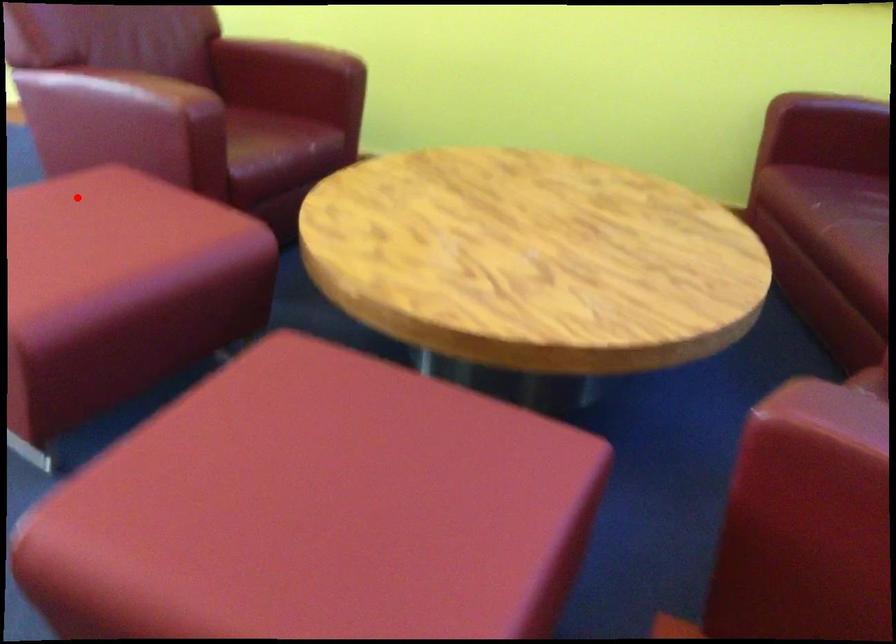
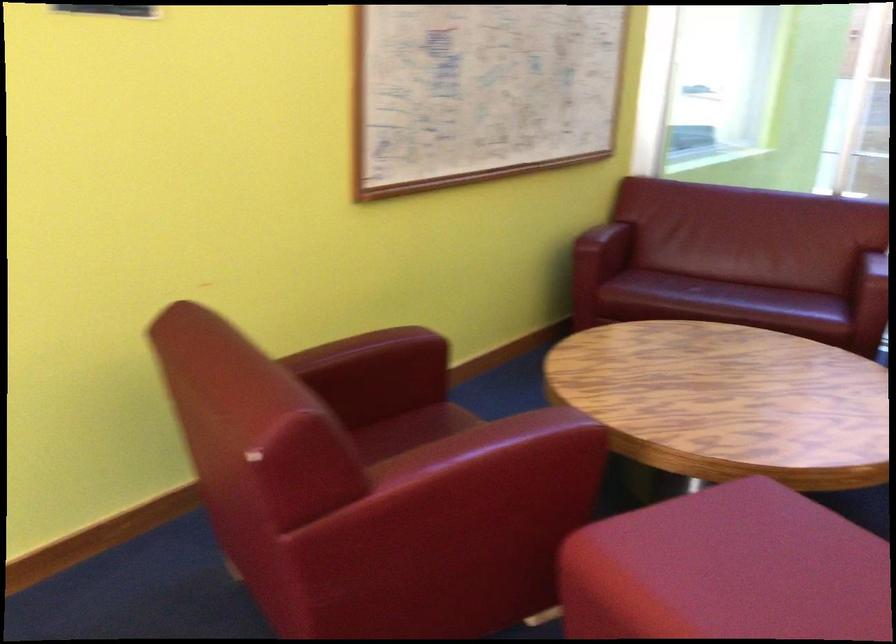
Question: A red point is marked in image1. In image2, is the corresponding 3D point closer to the camera or farther? Reply with the corresponding letter.

Choices:
 (A) The corresponding 3D point is closer.
 (B) The corresponding 3D point is farther.

Answer: (A)